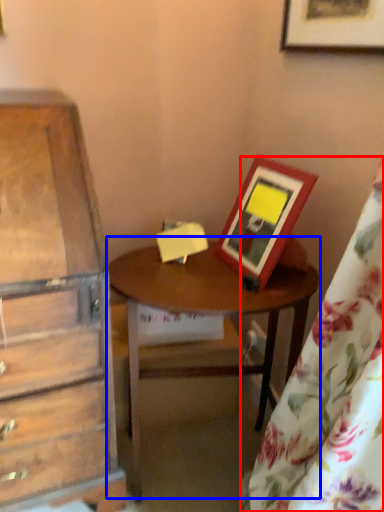
Question: Among these objects, which one is nearest to the camera, curtain (highlighted by a red box) or table (highlighted by a blue box)?

Choices:
 (A) curtain
 (B) table

Answer: (A)